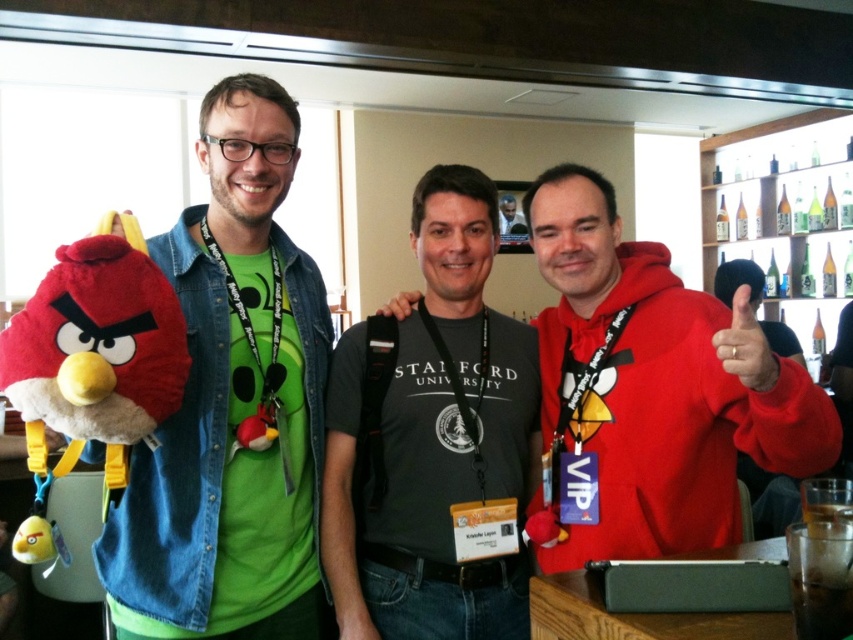
What is located at the coordinates point (x=231, y=404)?

The location at point (x=231, y=404) has the matte plush toy at left.

You are a photographer trying to capture a clear shot of both the matte plush toy at left and the red matte plush at center right. Since you want both to be in focus, you need to adjust your camera settings. Which of the two plush toys should you focus on to ensure both are sharp?

You should focus on the matte plush toy at left because it is closer to you than the red matte plush at center right. By focusing on the closer object, the depth of field will extend backward, potentially keeping both in focus.